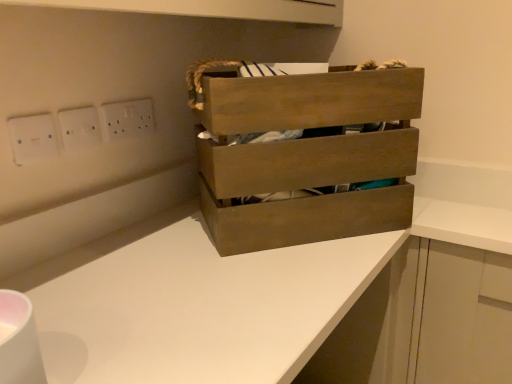
Where is `blank space situated above white matte counter at center (from a real-world perspective)`? Image resolution: width=512 pixels, height=384 pixels. blank space situated above white matte counter at center (from a real-world perspective) is located at coordinates (201, 267).